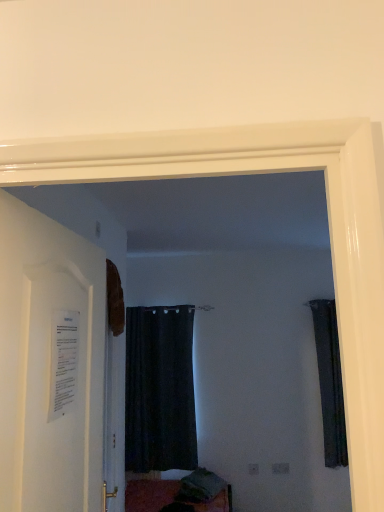
Measure the distance between black matte curtain at center, which ranks as the 1th curtain in left-to-right order, and camera.

The distance of black matte curtain at center, which ranks as the 1th curtain in left-to-right order, from camera is 3.57 meters.

Measure the distance between point (335, 380) and camera.

3.66 meters.

The width and height of the screenshot is (384, 512). Find the location of `white paper at left`. white paper at left is located at coordinates (48, 362).

From the picture: Can you confirm if white paper at left is positioned to the left of dark fabric curtain at right, which is counted as the 1th curtain, starting from the right?

Indeed, white paper at left is positioned on the left side of dark fabric curtain at right, which is counted as the 1th curtain, starting from the right.

From the image's perspective, which is below, white paper at left or dark fabric curtain at right, which is counted as the 1th curtain, starting from the right?

dark fabric curtain at right, which is counted as the 1th curtain, starting from the right, is shown below in the image.

Would you say white paper at left is a long distance from dark fabric curtain at right, which is counted as the 1th curtain, starting from the right?

Yes, white paper at left and dark fabric curtain at right, which is counted as the 1th curtain, starting from the right, are quite far apart.

Which point is more distant from viewer, [327,433] or [164,391]?

The point [164,391] is farther from the camera.

Considering the sizes of dark fabric curtain at right, which is the 2th curtain in left-to-right order, and black matte curtain at center, the second curtain from the right, in the image, is dark fabric curtain at right, which is the 2th curtain in left-to-right order, taller or shorter than black matte curtain at center, the second curtain from the right,?

In the image, dark fabric curtain at right, which is the 2th curtain in left-to-right order, appears to be shorter than black matte curtain at center, the second curtain from the right.

Considering the relative positions of dark fabric curtain at right, which is the 2th curtain in left-to-right order, and black matte curtain at center, which ranks as the 1th curtain in left-to-right order, in the image provided, is dark fabric curtain at right, which is the 2th curtain in left-to-right order, behind black matte curtain at center, which ranks as the 1th curtain in left-to-right order,?

No, dark fabric curtain at right, which is the 2th curtain in left-to-right order, is in front of black matte curtain at center, which ranks as the 1th curtain in left-to-right order.

Is dark fabric curtain at right, which is counted as the 1th curtain, starting from the right, oriented towards black matte curtain at center, the second curtain from the right?

No, dark fabric curtain at right, which is counted as the 1th curtain, starting from the right, is not turned towards black matte curtain at center, the second curtain from the right.

Is dark fabric curtain at right, which is the 2th curtain in left-to-right order, positioned beyond the bounds of white paper at left?

dark fabric curtain at right, which is the 2th curtain in left-to-right order, is positioned outside white paper at left.

Is dark fabric curtain at right, which is counted as the 1th curtain, starting from the right, aimed at white paper at left?

No.

The width and height of the screenshot is (384, 512). I want to click on curtain that is the 2nd object to the right of the white paper at left, starting at the anchor, so click(330, 381).

From the image's perspective, would you say dark fabric curtain at right, which is the 2th curtain in left-to-right order, is shown under white paper at left?

Yes, from the image's perspective, dark fabric curtain at right, which is the 2th curtain in left-to-right order, is below white paper at left.

Considering the sizes of objects black matte curtain at center, the second curtain from the right, and dark fabric curtain at right, which is counted as the 1th curtain, starting from the right, in the image provided, who is wider, black matte curtain at center, the second curtain from the right, or dark fabric curtain at right, which is counted as the 1th curtain, starting from the right,?

Wider between the two is black matte curtain at center, the second curtain from the right.

Where is `curtain that appears on the right of black matte curtain at center, which ranks as the 1th curtain in left-to-right order`? Image resolution: width=384 pixels, height=512 pixels. curtain that appears on the right of black matte curtain at center, which ranks as the 1th curtain in left-to-right order is located at coordinates (330, 381).

Considering the points (138, 358) and (323, 302), which point is behind, point (138, 358) or point (323, 302)?

The point (323, 302) is behind.

Can we say white paper at left lies outside black matte curtain at center, the second curtain from the right?

Yes.

Is white paper at left positioned with its back to black matte curtain at center, the second curtain from the right?

No, white paper at left is not facing the opposite direction of black matte curtain at center, the second curtain from the right.

Is the depth of white paper at left less than that of black matte curtain at center, the second curtain from the right?

Yes, the depth of white paper at left is less than that of black matte curtain at center, the second curtain from the right.

Considering the relative sizes of white paper at left and black matte curtain at center, which ranks as the 1th curtain in left-to-right order, in the image provided, is white paper at left wider than black matte curtain at center, which ranks as the 1th curtain in left-to-right order,?

No.

Is black matte curtain at center, which ranks as the 1th curtain in left-to-right order, shorter than white paper at left?

In fact, black matte curtain at center, which ranks as the 1th curtain in left-to-right order, may be taller than white paper at left.

Would you say white paper at left is part of black matte curtain at center, the second curtain from the right,'s contents?

No, white paper at left is not surrounded by black matte curtain at center, the second curtain from the right.

In the scene shown: How many degrees apart are the facing directions of black matte curtain at center, the second curtain from the right, and white paper at left?

87.8 degrees.

The image size is (384, 512). I want to click on door above the dark fabric curtain at right, which is the 2th curtain in left-to-right order (from the image's perspective), so click(48, 362).

You are a GUI agent. You are given a task and a screenshot of the screen. Output one action in this format:
    pyautogui.click(x=<x>, y=<y>)
    Task: Click on the curtain on the left of the dark fabric curtain at right, which is the 2th curtain in left-to-right order
    
    Given the screenshot: What is the action you would take?
    pyautogui.click(x=160, y=389)

Estimate the real-world distances between objects in this image. Which object is closer to black matte curtain at center, which ranks as the 1th curtain in left-to-right order, white paper at left or dark fabric curtain at right, which is counted as the 1th curtain, starting from the right?

dark fabric curtain at right, which is counted as the 1th curtain, starting from the right, lies closer to black matte curtain at center, which ranks as the 1th curtain in left-to-right order, than the other object.

When comparing their distances from black matte curtain at center, the second curtain from the right, does dark fabric curtain at right, which is counted as the 1th curtain, starting from the right, or white paper at left seem further?

white paper at left is positioned further to the anchor black matte curtain at center, the second curtain from the right.

When comparing their distances from white paper at left, does dark fabric curtain at right, which is the 2th curtain in left-to-right order, or black matte curtain at center, which ranks as the 1th curtain in left-to-right order, seem further?

Based on the image, dark fabric curtain at right, which is the 2th curtain in left-to-right order, appears to be further to white paper at left.

Consider the image. When comparing their distances from dark fabric curtain at right, which is the 2th curtain in left-to-right order, does white paper at left or black matte curtain at center, which ranks as the 1th curtain in left-to-right order, seem further?

white paper at left lies further to dark fabric curtain at right, which is the 2th curtain in left-to-right order, than the other object.

When comparing their distances from dark fabric curtain at right, which is counted as the 1th curtain, starting from the right, does black matte curtain at center, the second curtain from the right, or white paper at left seem closer?

black matte curtain at center, the second curtain from the right, is positioned closer to the anchor dark fabric curtain at right, which is counted as the 1th curtain, starting from the right.

Estimate the real-world distances between objects in this image. Which object is further from white paper at left, black matte curtain at center, which ranks as the 1th curtain in left-to-right order, or dark fabric curtain at right, which is counted as the 1th curtain, starting from the right?

dark fabric curtain at right, which is counted as the 1th curtain, starting from the right, lies further to white paper at left than the other object.

You are a GUI agent. You are given a task and a screenshot of the screen. Output one action in this format:
    pyautogui.click(x=<x>, y=<y>)
    Task: Click on the curtain between white paper at left and black matte curtain at center, which ranks as the 1th curtain in left-to-right order, from front to back
    
    Given the screenshot: What is the action you would take?
    pyautogui.click(x=330, y=381)